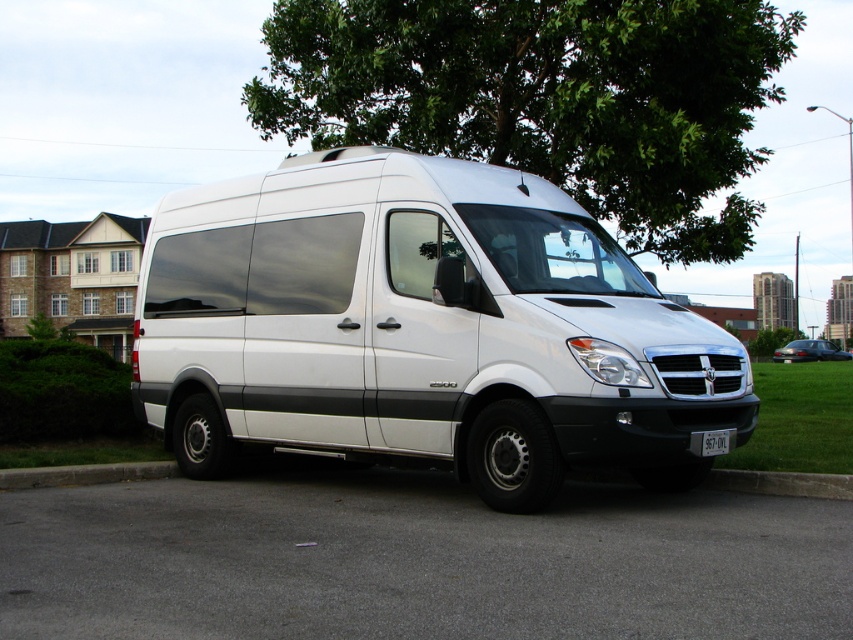
Based on the photo, is white matte van at center in front of gray concrete curb at lower right?

Yes, it is.

The height and width of the screenshot is (640, 853). I want to click on white matte van at center, so click(x=422, y=328).

Does green leafy tree at upper center have a lesser height compared to gray concrete curb at lower right?

No.

Does point (283, 74) come farther from viewer compared to point (790, 474)?

Yes, point (283, 74) is farther from viewer.

Where is `green leafy tree at upper center`? green leafy tree at upper center is located at coordinates (546, 97).

From the picture: Is concrete at lower center thinner than gray concrete curb at lower right?

No.

Which is above, concrete at lower center or gray concrete curb at lower right?

gray concrete curb at lower right is above.

Between point (97, 474) and point (790, 488), which one is positioned behind?

Positioned behind is point (97, 474).

Identify the location of concrete at lower center. This screenshot has width=853, height=640. point(84,474).